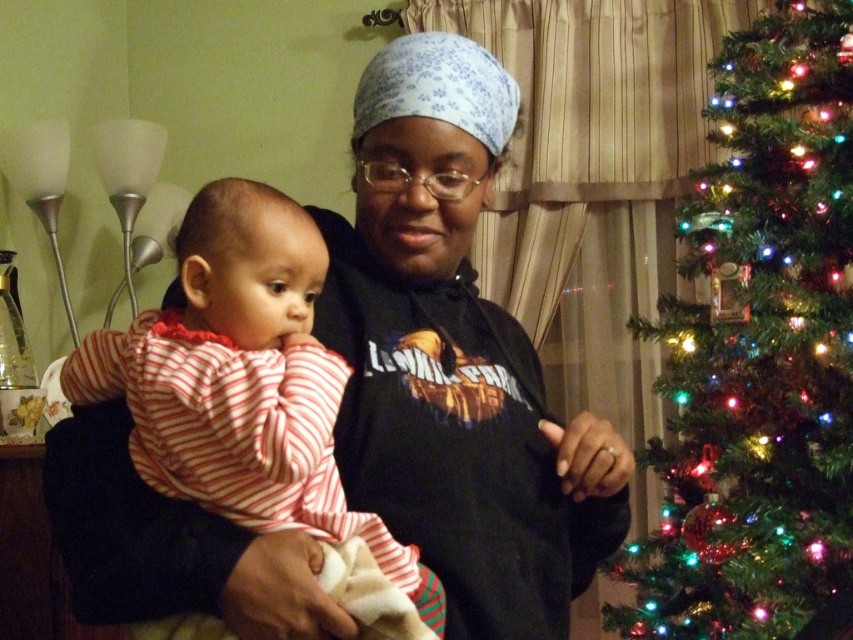
Is black matte hoodie at center to the left of iridescent plastic tree at right from the viewer's perspective?

Indeed, black matte hoodie at center is positioned on the left side of iridescent plastic tree at right.

Between black matte hoodie at center and iridescent plastic tree at right, which one has more height?

With more height is iridescent plastic tree at right.

What do you see at coordinates (456, 358) in the screenshot? I see `black matte hoodie at center` at bounding box center [456, 358].

At what (x,y) coordinates should I click in order to perform the action: click on black matte hoodie at center. Please return your answer as a coordinate pair (x, y). Looking at the image, I should click on (456, 358).